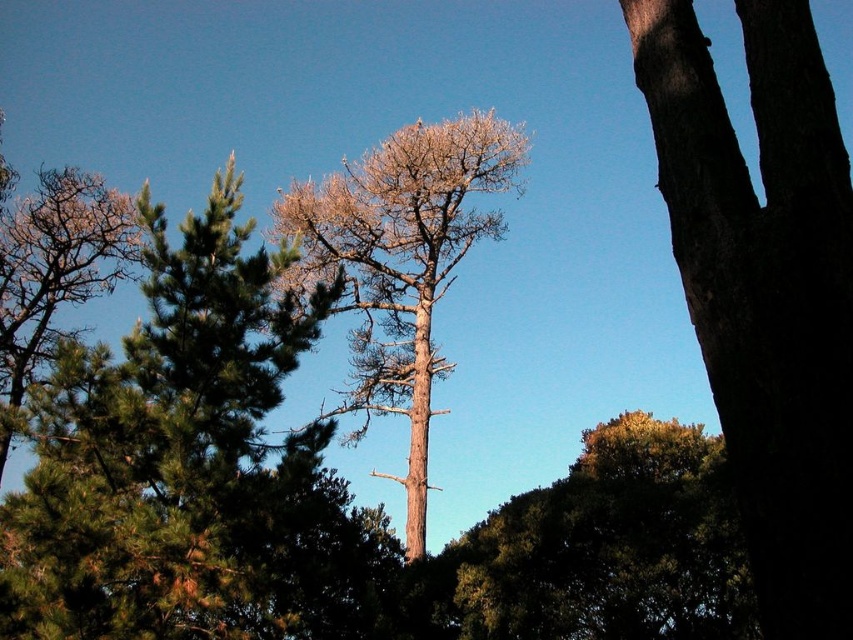
Is dark brown bark tree at right below bare wood tree at left?

No, dark brown bark tree at right is not below bare wood tree at left.

Does dark brown bark tree at right have a smaller size compared to bare wood tree at left?

Indeed, dark brown bark tree at right has a smaller size compared to bare wood tree at left.

Does point (817, 380) come in front of point (3, 198)?

That is True.

The image size is (853, 640). In order to click on dark brown bark tree at right in this screenshot , I will do `click(764, 289)`.

Who is taller, dark brown bark tree at right or green leafy tree at center?

Standing taller between the two is dark brown bark tree at right.

Between dark brown bark tree at right and green leafy tree at center, which one appears on the left side from the viewer's perspective?

dark brown bark tree at right

Describe the element at coordinates (764, 289) in the screenshot. Image resolution: width=853 pixels, height=640 pixels. I see `dark brown bark tree at right` at that location.

Image resolution: width=853 pixels, height=640 pixels. Find the location of `dark brown bark tree at right`. dark brown bark tree at right is located at coordinates (764, 289).

Can you confirm if green leafy tree at center is taller than bare wood tree at center?

No.

What do you see at coordinates (608, 547) in the screenshot? Image resolution: width=853 pixels, height=640 pixels. I see `green leafy tree at center` at bounding box center [608, 547].

Is point (589, 531) less distant than point (375, 177)?

Yes, point (589, 531) is in front of point (375, 177).

The image size is (853, 640). I want to click on green leafy tree at center, so click(608, 547).